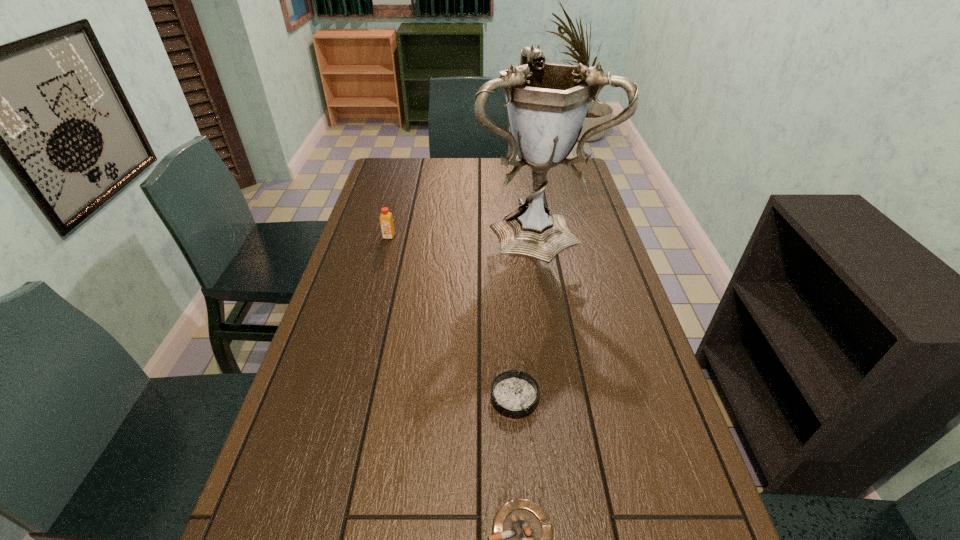
This screenshot has width=960, height=540. Identify the location of the second closest object to the trophy cup. (514, 394).

Where is `vacant region that satisfies the following two spatial constraints: 1. on the front and back of the second tallest object; 2. on the right side of the second nearest object`? vacant region that satisfies the following two spatial constraints: 1. on the front and back of the second tallest object; 2. on the right side of the second nearest object is located at coordinates (347, 397).

Find the location of `free space that satisfies the following two spatial constraints: 1. on the front and back of the leftmost object; 2. on the right side of the farther ashtray`. free space that satisfies the following two spatial constraints: 1. on the front and back of the leftmost object; 2. on the right side of the farther ashtray is located at coordinates (347, 397).